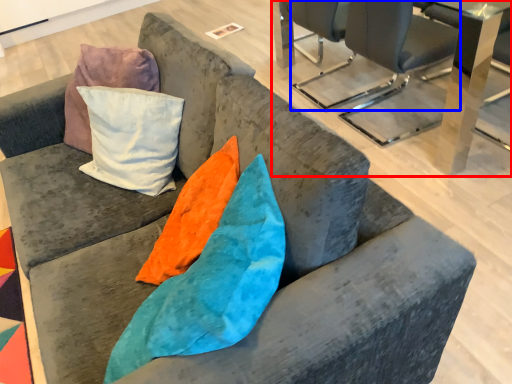
Question: Which point is closer to the camera, table (highlighted by a red box) or chair (highlighted by a blue box)?

Choices:
 (A) table
 (B) chair

Answer: (A)